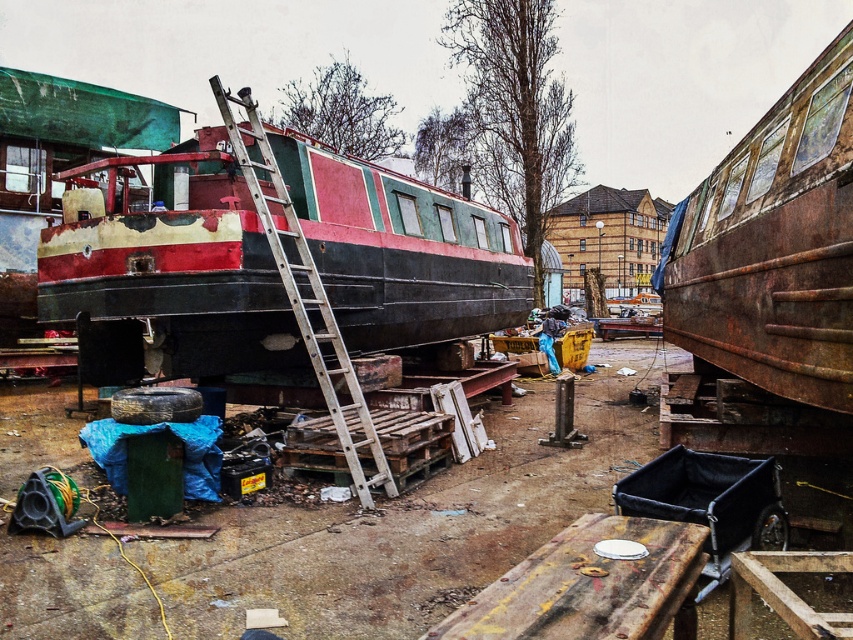
Question: Estimate the real-world distances between objects in this image. Which object is farther from the rusty metal boat at center?

Choices:
 (A) rusty metal train car at right
 (B) wooden at left

Answer: (A)

Question: Which object appears farthest from the camera in this image?

Choices:
 (A) rusty metal dock at lower center
 (B) rusty metal boat at center
 (C) wooden at left

Answer: (B)

Question: Considering the real-world distances, which object is closest to the rusty metal train car at right?

Choices:
 (A) wooden at left
 (B) rusty metal boat at center

Answer: (A)

Question: Where is rusty metal dock at lower center located in relation to wooden at left in the image?

Choices:
 (A) below
 (B) above

Answer: (A)

Question: Does rusty metal dock at lower center have a greater width compared to wooden at left?

Choices:
 (A) no
 (B) yes

Answer: (A)

Question: Is rusty metal boat at center positioned at the back of rusty metal dock at lower center?

Choices:
 (A) yes
 (B) no

Answer: (A)